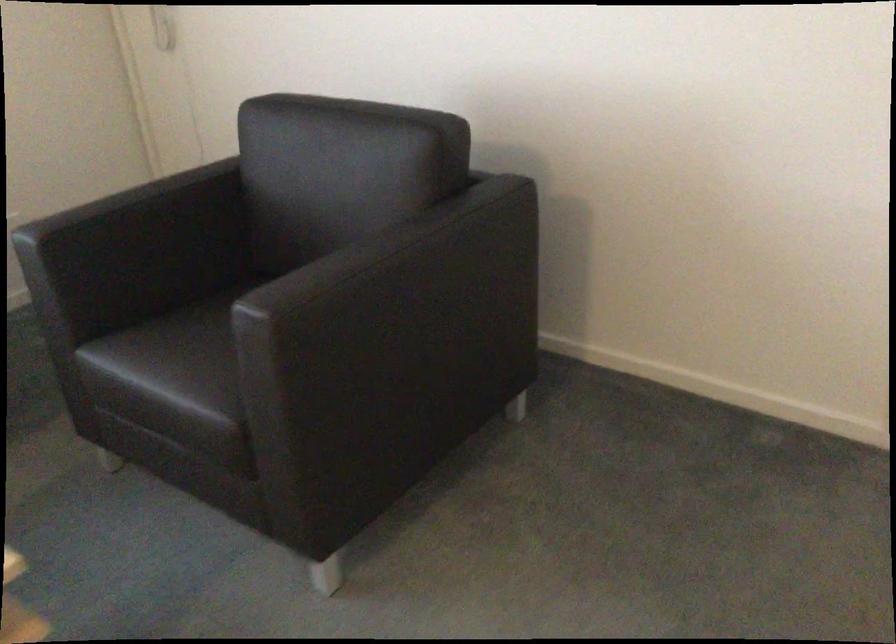
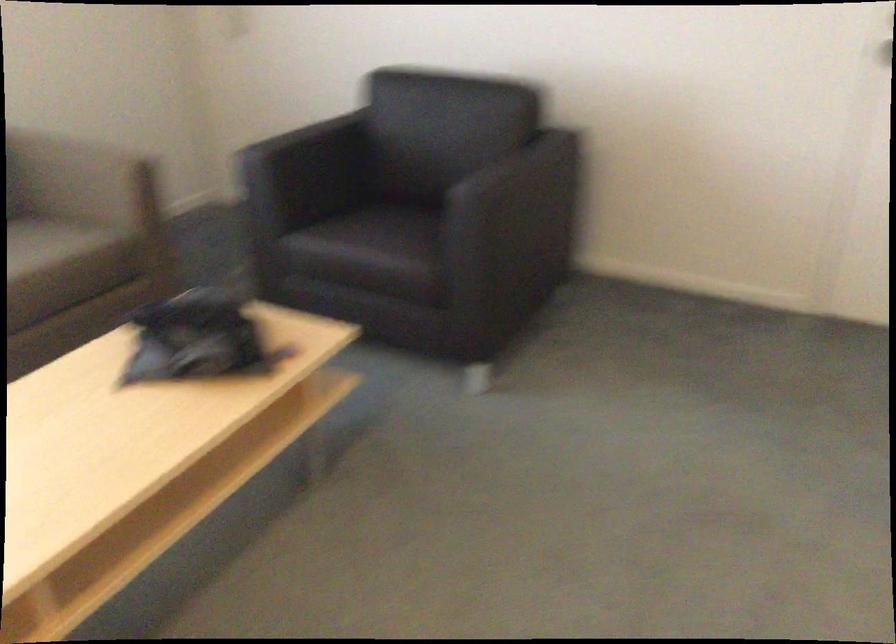
In the second image, find the point that corresponds to the point at 161,370 in the first image.

(368, 240)